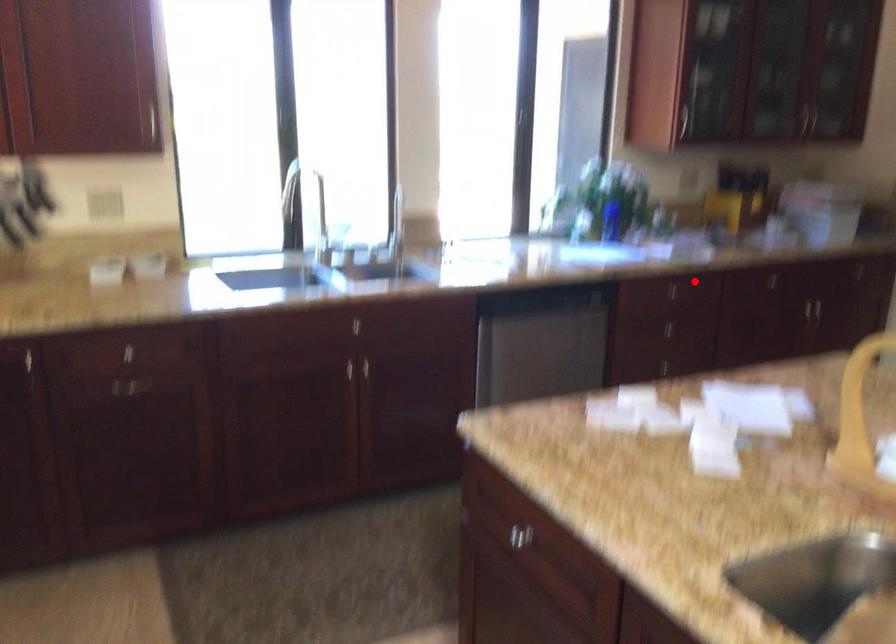
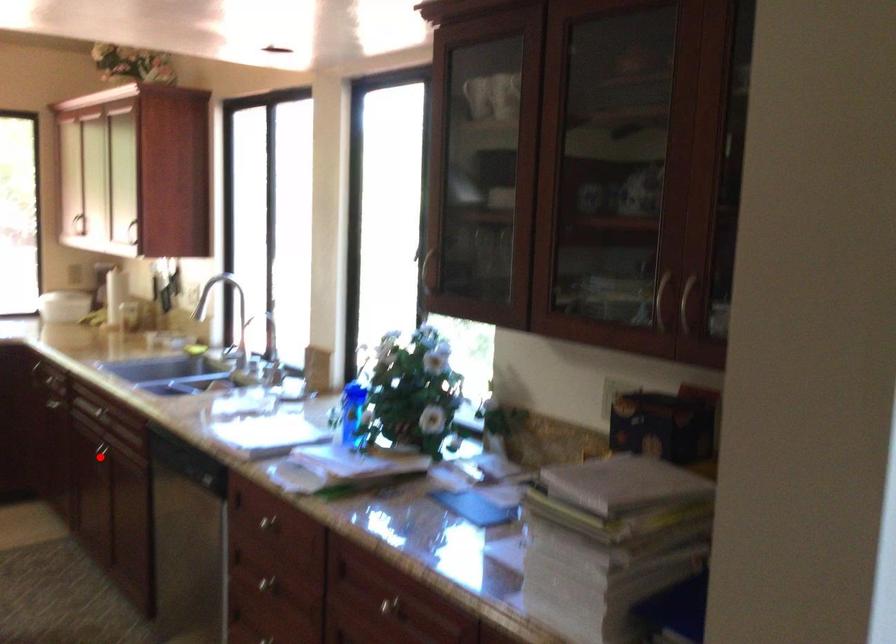
I am providing you with two images of the same scene from different viewpoints. A red point is marked on the first image and another point is marked on the second image. Is the red point in image1 aligned with the point shown in image2?

No